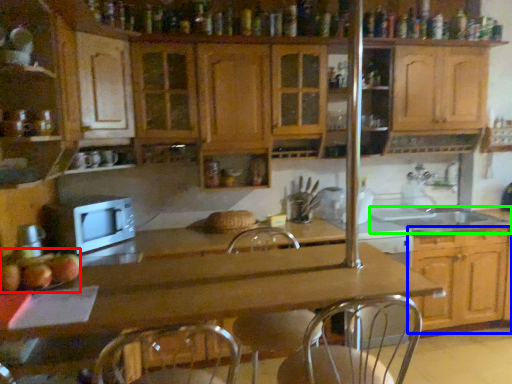
Question: Considering the real-world distances, which object is closest to apple (highlighted by a red box)? cabinetry (highlighted by a blue box) or sink (highlighted by a green box).

Choices:
 (A) cabinetry
 (B) sink

Answer: (A)